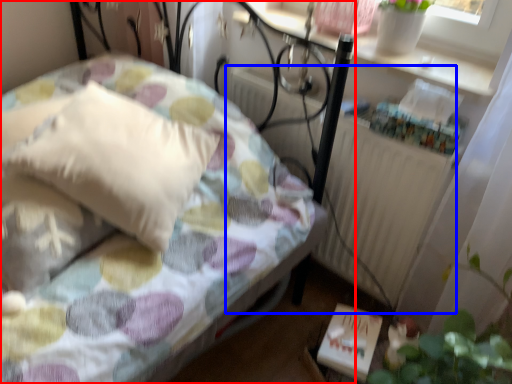
Question: Which object is closer to the camera taking this photo, bed (highlighted by a red box) or radiator (highlighted by a blue box)?

Choices:
 (A) bed
 (B) radiator

Answer: (A)